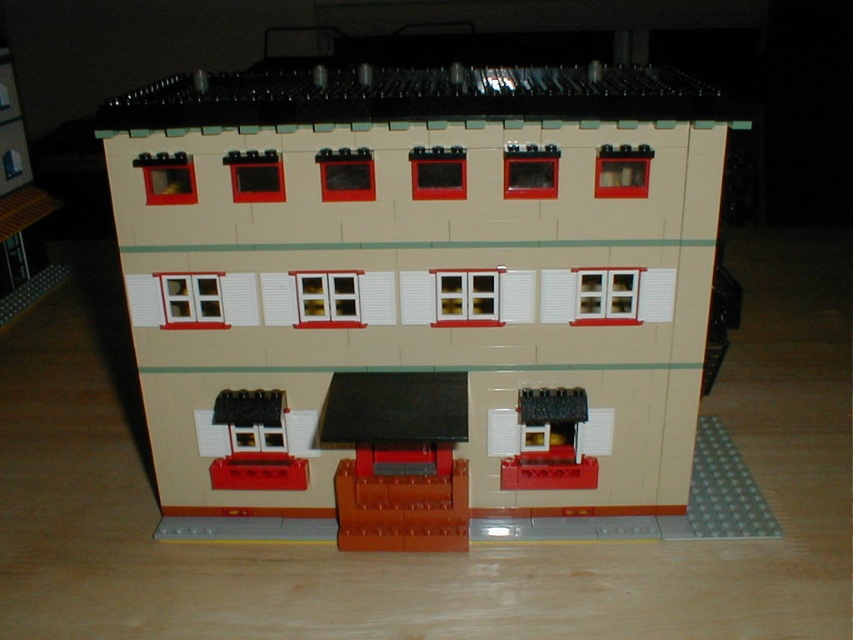
Question: Is smooth brown table at center bigger than matte black awning at center?

Choices:
 (A) no
 (B) yes

Answer: (B)

Question: Does beige matte building at center appear on the right side of matte black awning at center?

Choices:
 (A) yes
 (B) no

Answer: (B)

Question: Which point appears farthest from the camera in this image?

Choices:
 (A) (558, 451)
 (B) (328, 93)
 (C) (440, 419)

Answer: (A)

Question: Among these objects, which one is farthest from the camera?

Choices:
 (A) matte black awning at center
 (B) smooth brown table at center

Answer: (A)

Question: Is beige matte building at center below matte black awning at center?

Choices:
 (A) no
 (B) yes

Answer: (A)

Question: Which object is the closest to the beige matte building at center?

Choices:
 (A) smooth brown table at center
 (B) matte black awning at center

Answer: (A)